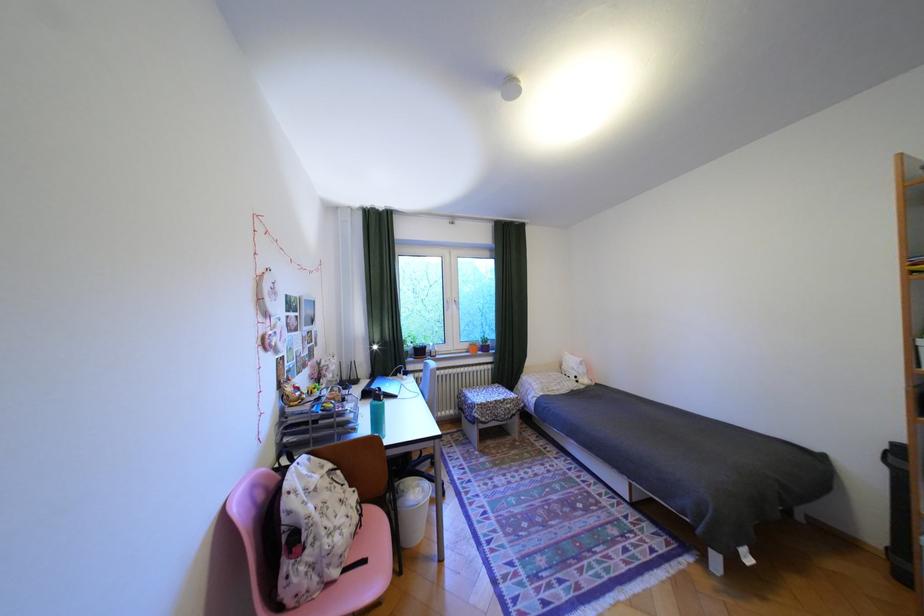
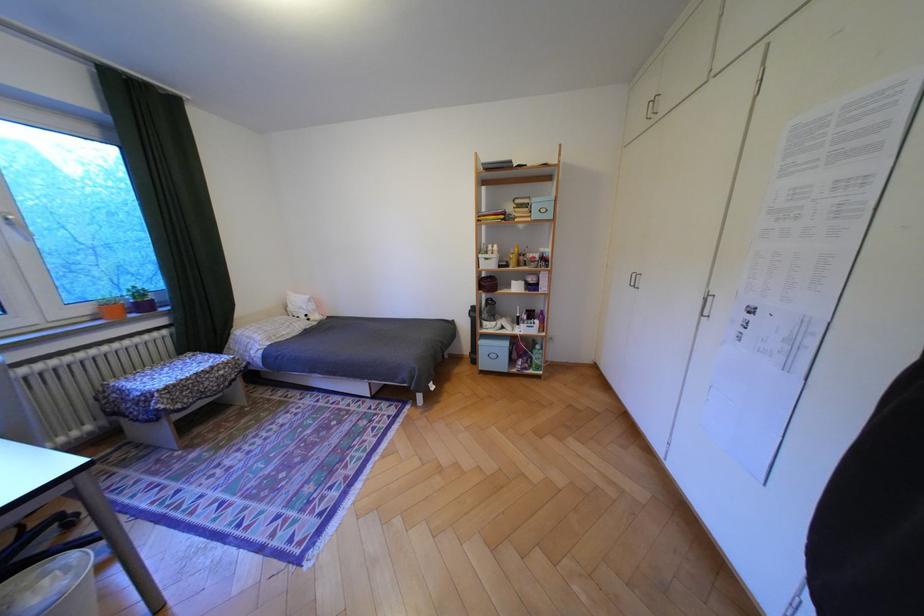
The point at (x=466, y=304) is marked in the first image. Where is the corresponding point in the second image?

(18, 227)